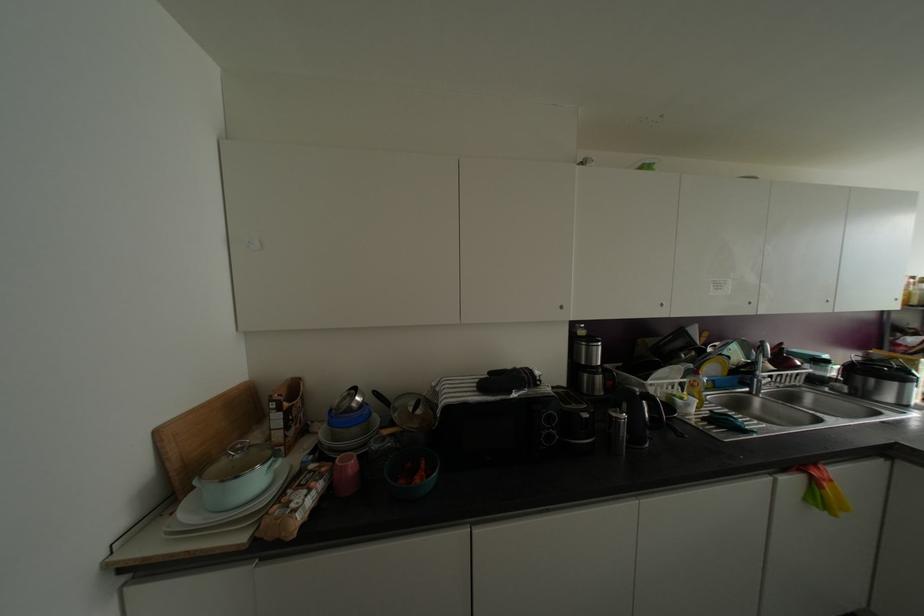
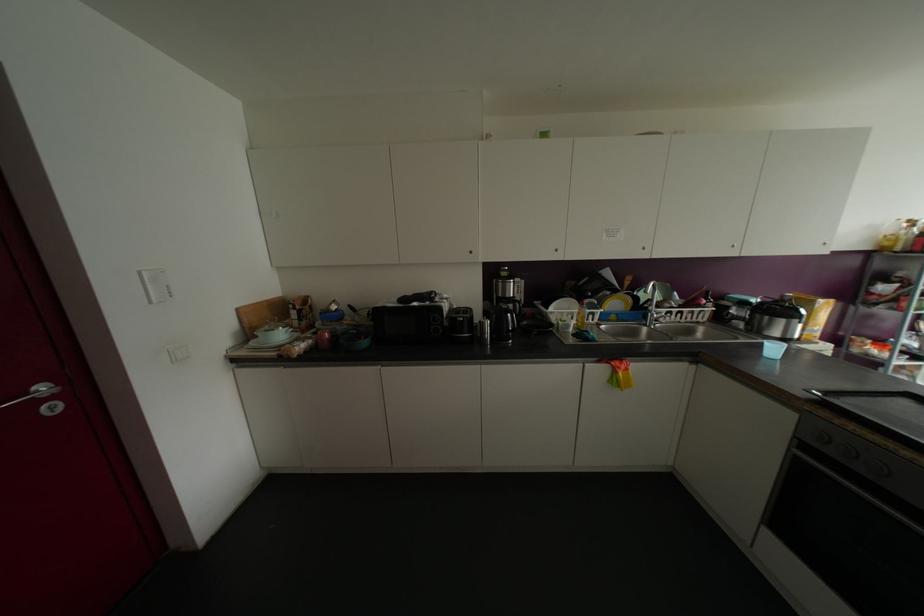
Question: The camera is either moving clockwise (left) or counter-clockwise (right) around the object. The first image is from the beginning of the video and the second image is from the end. Is the camera moving left or right when shooting the video?

Choices:
 (A) Left
 (B) Right

Answer: (B)